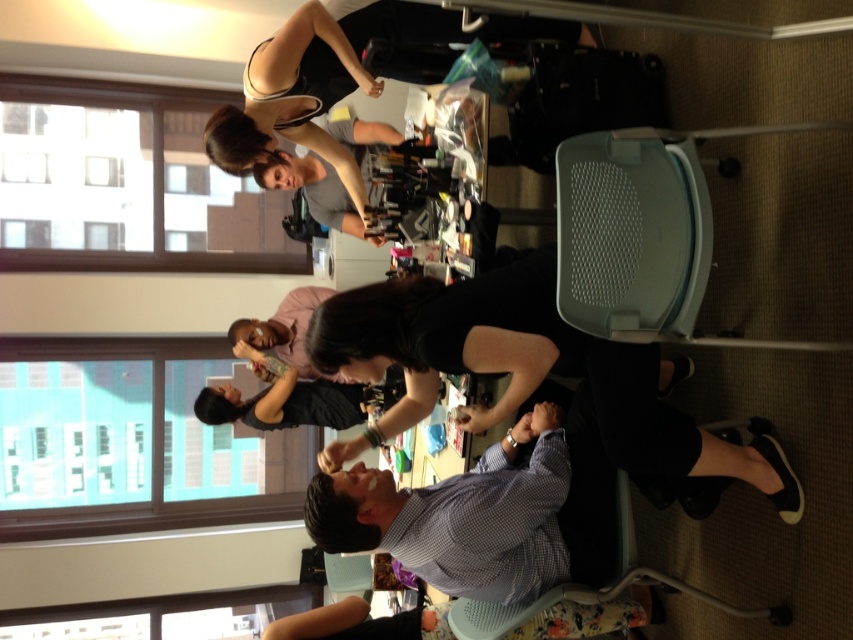
Question: Is black matte shirt at center thinner than black matte tank top at upper center?

Choices:
 (A) no
 (B) yes

Answer: (A)

Question: Can you confirm if black matte shirt at center is smaller than checkered fabric shirt at center?

Choices:
 (A) no
 (B) yes

Answer: (A)

Question: Which of the following is the farthest from the observer?

Choices:
 (A) black matte tank top at upper center
 (B) checkered fabric shirt at center
 (C) black matte shirt at center

Answer: (A)

Question: Does black matte shirt at center appear on the right side of black matte tank top at upper center?

Choices:
 (A) yes
 (B) no

Answer: (A)

Question: Which object appears closest to the camera in this image?

Choices:
 (A) checkered fabric shirt at center
 (B) black matte tank top at upper center

Answer: (A)

Question: Considering the real-world distances, which object is farthest from the checkered fabric shirt at center?

Choices:
 (A) black matte shirt at center
 (B) black matte tank top at upper center

Answer: (B)